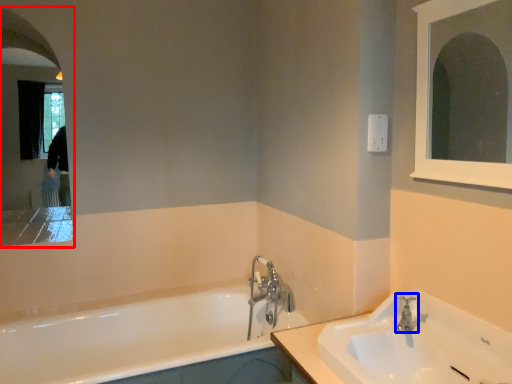
Question: Which object appears closest to the camera in this image, medicine cabinet (highlighted by a red box) or tap (highlighted by a blue box)?

Choices:
 (A) medicine cabinet
 (B) tap

Answer: (B)